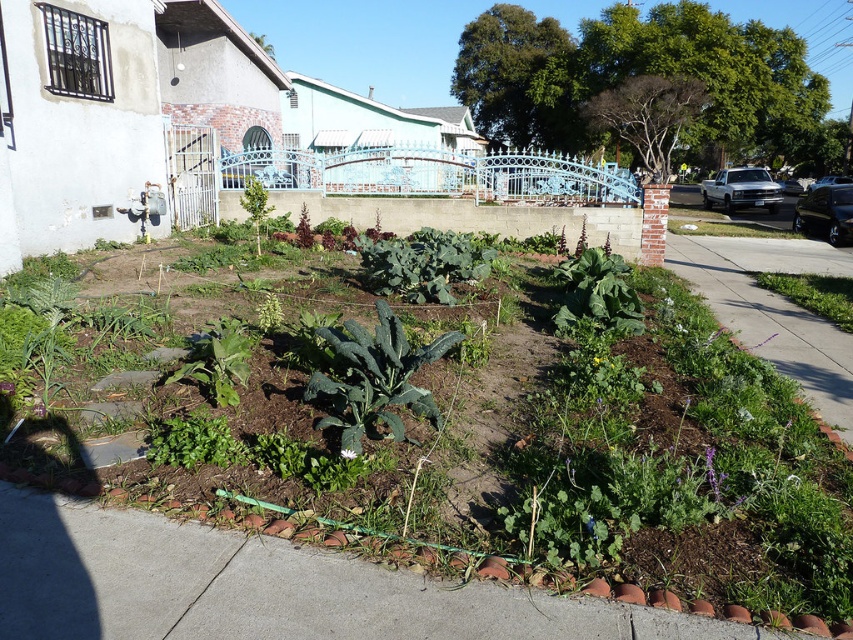
Question: From the image, what is the correct spatial relationship of green leafy vegetables at center in relation to green grass at lower right?

Choices:
 (A) above
 (B) below

Answer: (B)

Question: Can you confirm if green leafy vegetables at center is bigger than green grass at lower right?

Choices:
 (A) no
 (B) yes

Answer: (A)

Question: Among these points, which one is farthest from the camera?

Choices:
 (A) (677, 241)
 (B) (415, 493)

Answer: (A)

Question: From the image, what is the correct spatial relationship of green leafy vegetables at center in relation to green grass at lower right?

Choices:
 (A) right
 (B) left

Answer: (B)